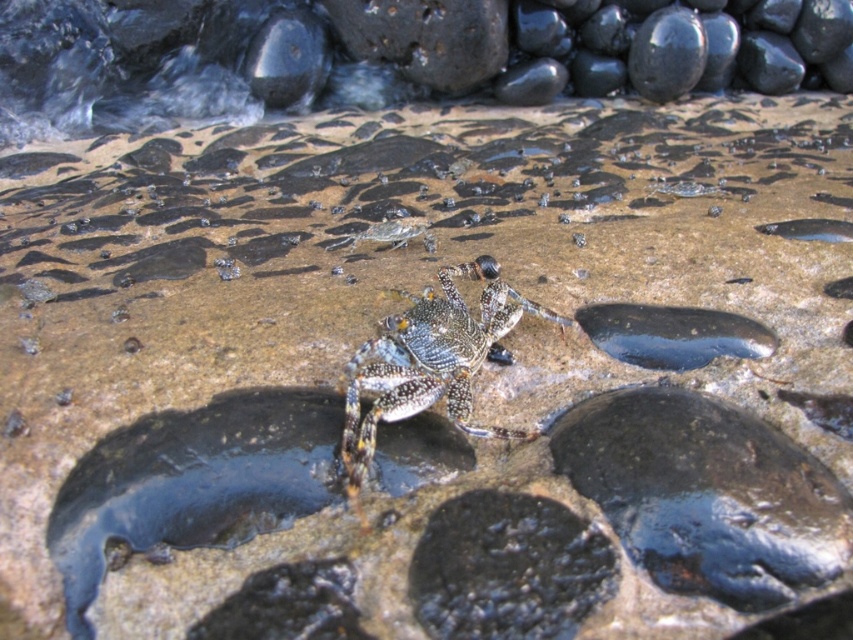
From the picture: You are a photographer trying to capture the shiny metallic crab at center and the glossy dark blue puddle at center right. Which object should you focus on first if you want to ensure both are in focus without adjusting your camera settings?

The glossy dark blue puddle at center right is closer to the viewer than the shiny metallic crab at center. To ensure both are in focus, you should focus on the shiny metallic crab at center first because it is farther away, allowing the depth of field to cover the closer puddle as well.

You are a photographer trying to capture the sparkling metallic crab at center and the glossy dark blue puddle at center right in a single shot. Based on their sizes, which object should you focus on first to ensure both are in frame?

The sparkling metallic crab at center is larger in width than the glossy dark blue puddle at center right, so you should focus on the sparkling metallic crab at center first to ensure both fit within the frame.

You are a photographer trying to capture the shiny metallic crab at center and the glossy dark blue puddle at center right in the same frame. Based on their positions, which object should you adjust your camera to focus on first if you want to ensure both are in the frame?

The glossy dark blue puddle at center right is to the right of the shiny metallic crab at center. To include both in the frame, focus on the shiny metallic crab at center first since it is closer to the center and adjust the camera angle to include the puddle to its right.